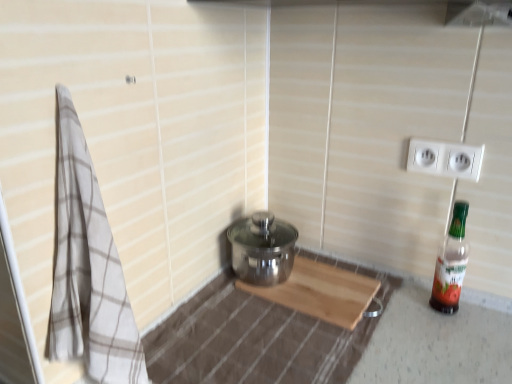
Question: Considering the positions of point 72,114 and point 457,172, is point 72,114 closer or farther from the camera than point 457,172?

Choices:
 (A) closer
 (B) farther

Answer: (A)

Question: From their relative heights in the image, would you say beige checkered towel at left is taller or shorter than white plastic electric outlet at upper right?

Choices:
 (A) tall
 (B) short

Answer: (A)

Question: Which is nearer to the beige checkered towel at left?

Choices:
 (A) translucent plastic bottle at right
 (B) white plastic electric outlet at upper right

Answer: (A)

Question: Considering the real-world distances, which object is closest to the beige checkered towel at left?

Choices:
 (A) translucent plastic bottle at right
 (B) white plastic electric outlet at upper right

Answer: (A)